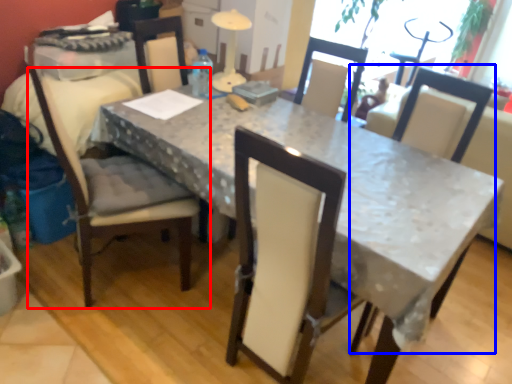
Question: Which object is further to the camera taking this photo, chair (highlighted by a red box) or chair (highlighted by a blue box)?

Choices:
 (A) chair
 (B) chair

Answer: (B)